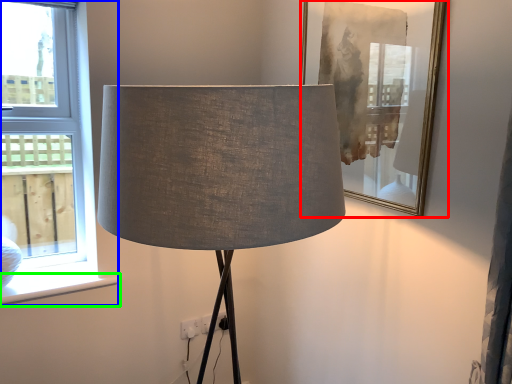
Question: Based on their relative distances, which object is nearer to picture frame (highlighted by a red box)? Choose from window (highlighted by a blue box) and window sill (highlighted by a green box).

Choices:
 (A) window
 (B) window sill

Answer: (A)